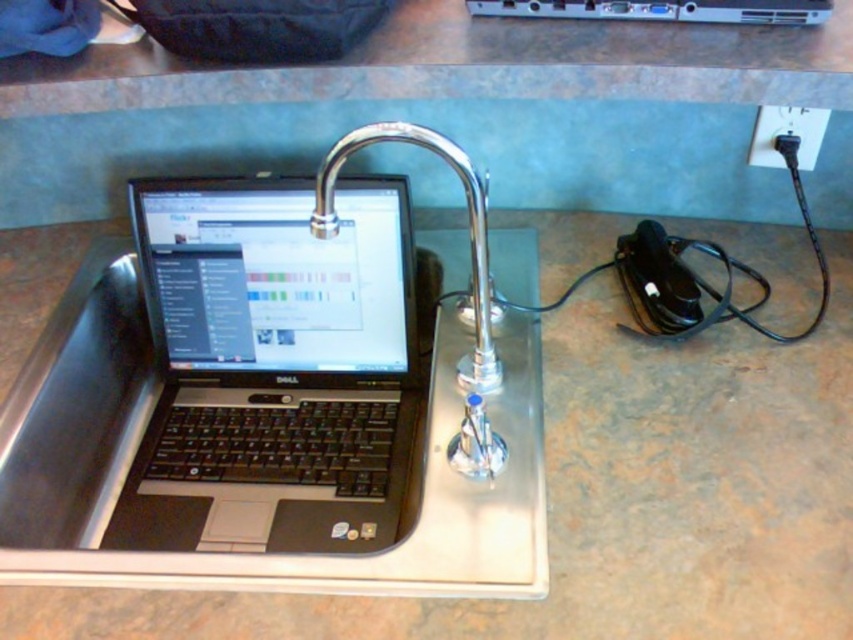
You are a technician inspecting a setup where a metallic silver computer at upper center is plugged into a black plastic plug at upper right. You need to ensure that the plug can support the computer. Given that the plug has a maximum width capacity of 10 cm, can the plug safely accommodate the computer?

The metallic silver computer at upper center is wider than the black plastic plug at upper right. Since the plug can only handle up to 10 cm, the computer might not fit securely, so it is unsafe to use this plug.